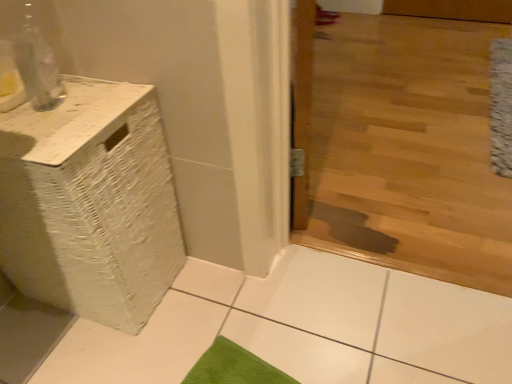
Question: From a real-world perspective, does white textured mat at right stand above white woven basket at left?

Choices:
 (A) yes
 (B) no

Answer: (B)

Question: From a real-world perspective, is white textured mat at right physically below white woven basket at left?

Choices:
 (A) yes
 (B) no

Answer: (A)

Question: Would you say white textured mat at right is outside white woven basket at left?

Choices:
 (A) no
 (B) yes

Answer: (B)

Question: Could you tell me if white textured mat at right is facing white woven basket at left?

Choices:
 (A) no
 (B) yes

Answer: (A)

Question: Does white textured mat at right appear on the left side of white woven basket at left?

Choices:
 (A) no
 (B) yes

Answer: (A)

Question: Does white textured mat at right have a lesser width compared to white woven basket at left?

Choices:
 (A) yes
 (B) no

Answer: (B)

Question: Can you confirm if white woven basket at left is positioned to the right of white textured mat at right?

Choices:
 (A) yes
 (B) no

Answer: (B)

Question: Can you confirm if white woven basket at left is smaller than white textured mat at right?

Choices:
 (A) yes
 (B) no

Answer: (B)

Question: Is white woven basket at left to the left of white textured mat at right from the viewer's perspective?

Choices:
 (A) yes
 (B) no

Answer: (A)

Question: Would you consider white woven basket at left to be distant from white textured mat at right?

Choices:
 (A) no
 (B) yes

Answer: (B)

Question: Is white woven basket at left located outside white textured mat at right?

Choices:
 (A) yes
 (B) no

Answer: (A)

Question: From the image's perspective, is white woven basket at left under white textured mat at right?

Choices:
 (A) no
 (B) yes

Answer: (B)

Question: Considering the relative positions of white textured mat at right and white woven basket at left in the image provided, is white textured mat at right to the left or to the right of white woven basket at left?

Choices:
 (A) left
 (B) right

Answer: (B)